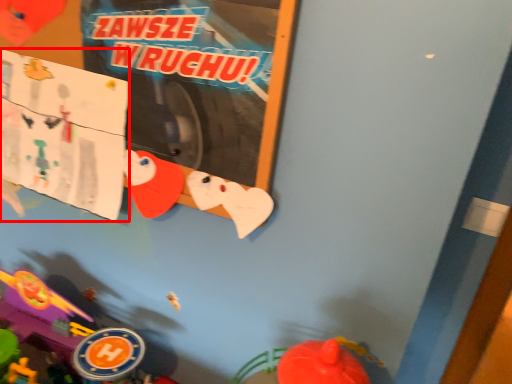
Question: Considering the relative positions of poster page (annotated by the red box) and toy in the image provided, where is poster page (annotated by the red box) located with respect to the staircase?

Choices:
 (A) left
 (B) right

Answer: (B)